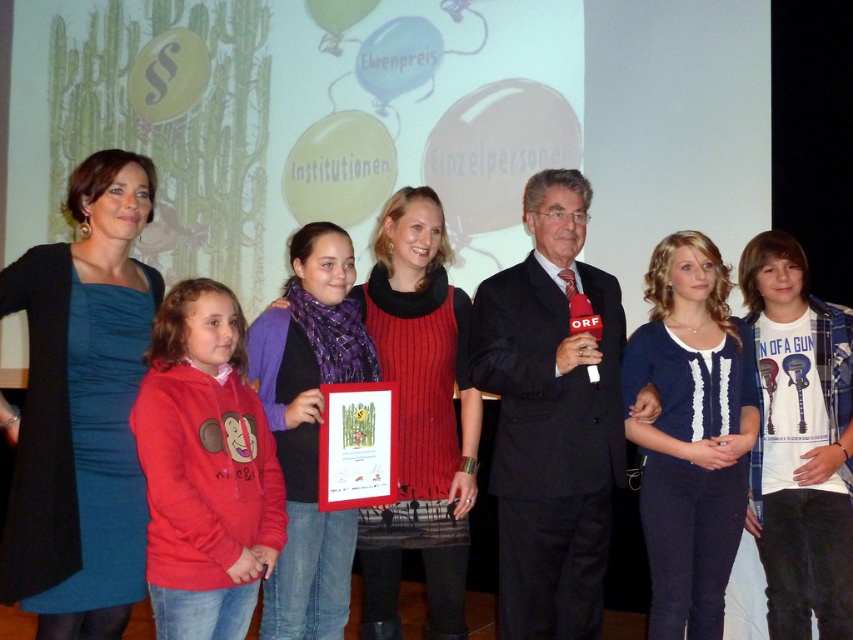
How much distance is there between matte red sweater at center and purple knitwear at center?

A distance of 24.79 centimeters exists between matte red sweater at center and purple knitwear at center.

Between matte red sweater at center and purple knitwear at center, which one appears on the left side from the viewer's perspective?

purple knitwear at center is more to the left.

Describe the element at coordinates (421, 417) in the screenshot. I see `matte red sweater at center` at that location.

This screenshot has height=640, width=853. Find the location of `matte red sweater at center`. matte red sweater at center is located at coordinates (421, 417).

Does teal satin dress at center appear on the right side of blue knit sweater at center?

In fact, teal satin dress at center is to the left of blue knit sweater at center.

Can you confirm if teal satin dress at center is thinner than blue knit sweater at center?

Indeed, teal satin dress at center has a lesser width compared to blue knit sweater at center.

The width and height of the screenshot is (853, 640). Describe the element at coordinates (80, 408) in the screenshot. I see `teal satin dress at center` at that location.

The height and width of the screenshot is (640, 853). What are the coordinates of `teal satin dress at center` in the screenshot? It's located at (80, 408).

Between teal satin dress at center and matte red sweater at center, which one is positioned higher?

teal satin dress at center is above.

This screenshot has width=853, height=640. Describe the element at coordinates (80, 408) in the screenshot. I see `teal satin dress at center` at that location.

Is point (96, 518) positioned before point (421, 467)?

Yes, it is in front of point (421, 467).

Where is `teal satin dress at center`? teal satin dress at center is located at coordinates (80, 408).